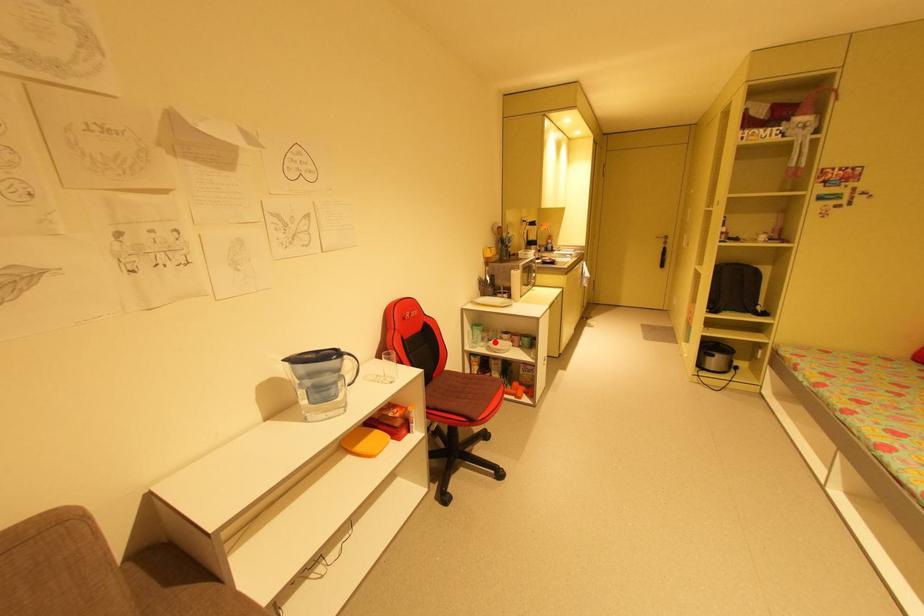
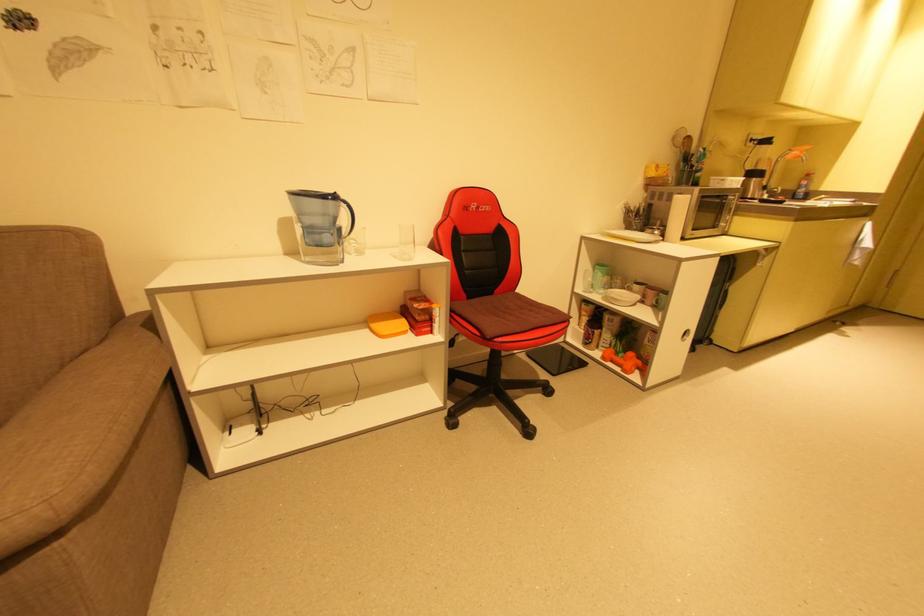
Find the pixel in the second image that matches the highlighted location in the first image.

(616, 290)